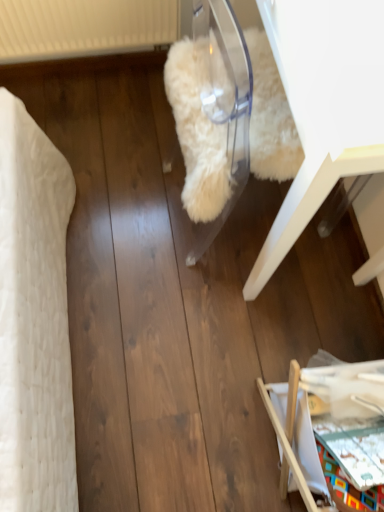
Find the location of `vacant position to the left of wooden folding chair at lower right, marked as the first furniture in a bottom-to-top arrangement`. vacant position to the left of wooden folding chair at lower right, marked as the first furniture in a bottom-to-top arrangement is located at coordinates (213, 406).